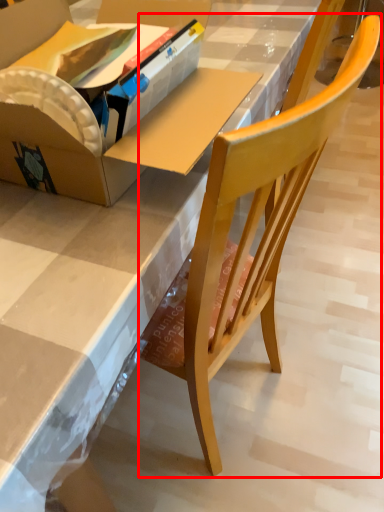
Question: From the image's perspective, what is the correct spatial relationship of chair (annotated by the red box) in relation to box?

Choices:
 (A) above
 (B) below

Answer: (B)